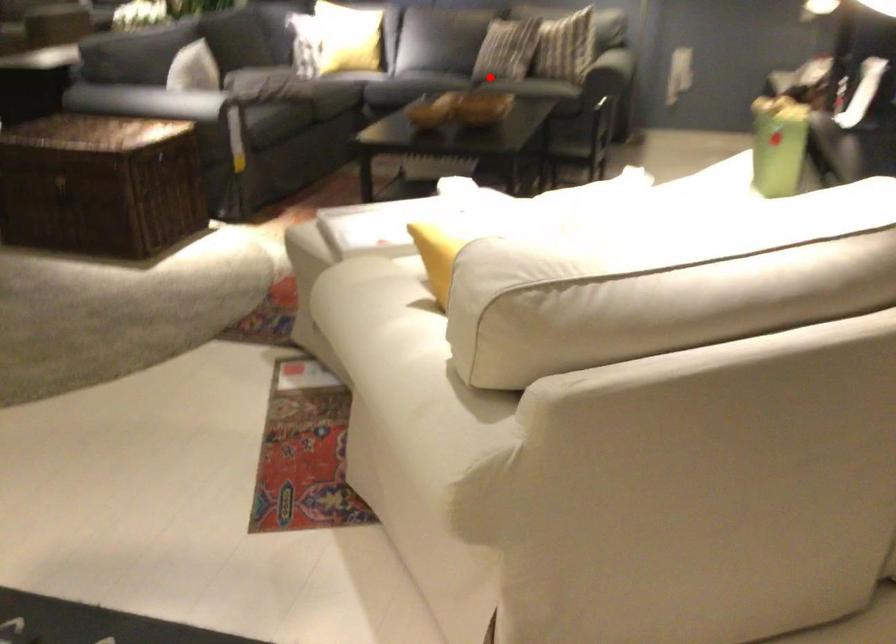
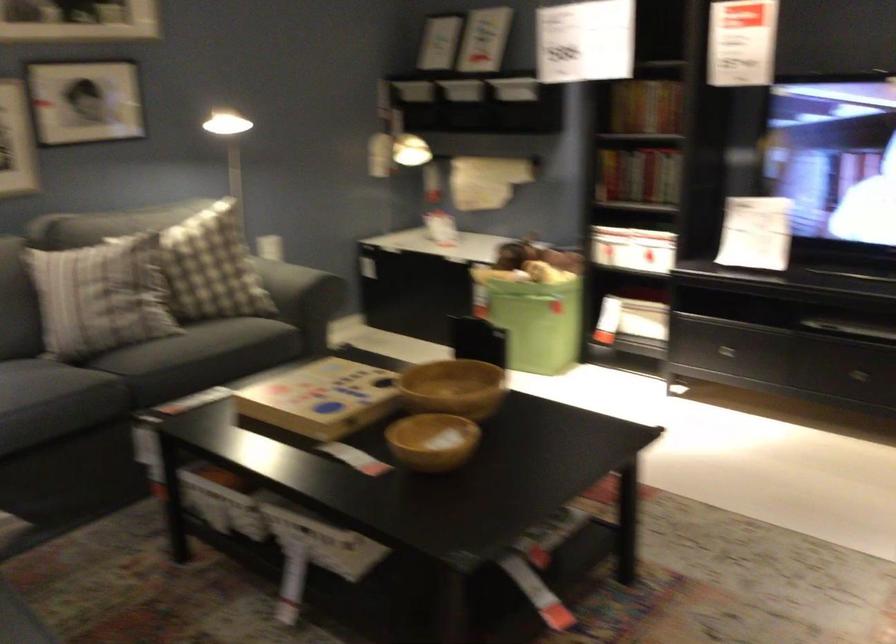
Find the pixel in the second image that matches the highlighted location in the first image.

(199, 357)